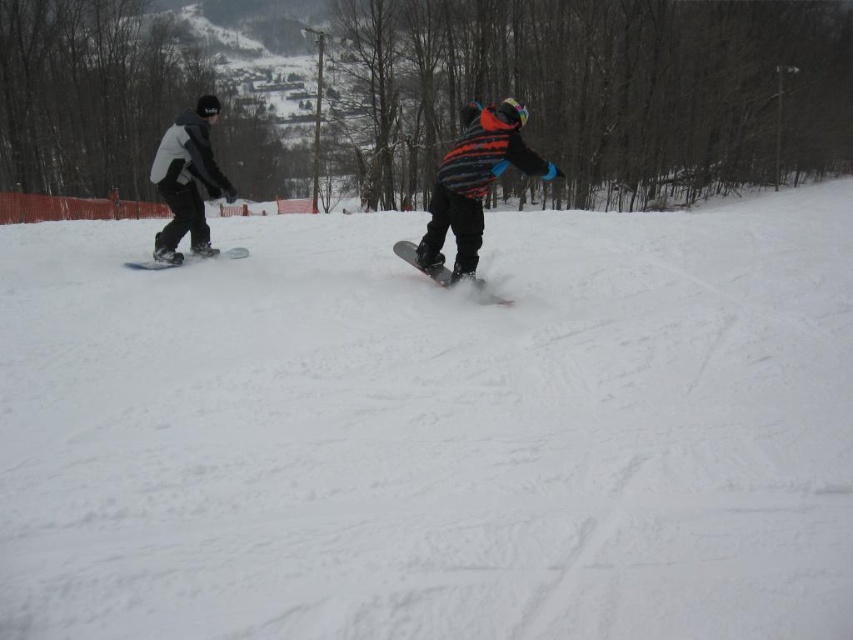
Question: Is white matte snow at center thinner than matte black snowboarders at center?

Choices:
 (A) no
 (B) yes

Answer: (A)

Question: Is striped woolen sweater at center above black matte snowboard at left?

Choices:
 (A) no
 (B) yes

Answer: (B)

Question: Which of the following is the farthest from the observer?

Choices:
 (A) matte black snowboard at center
 (B) matte black snowboarders at center
 (C) white matte snow at center
 (D) striped woolen sweater at center

Answer: (A)

Question: Where is striped woolen sweater at center located in relation to matte black snowboard at center in the image?

Choices:
 (A) above
 (B) below

Answer: (A)

Question: Which of the following is the closest to the observer?

Choices:
 (A) (479, 289)
 (B) (233, 257)

Answer: (A)

Question: Which of these objects is positioned closest to the white matte snow at center?

Choices:
 (A) matte black snowboarders at center
 (B) matte black snowboard at center
 (C) black matte snowboard at left
 (D) striped woolen sweater at center

Answer: (A)